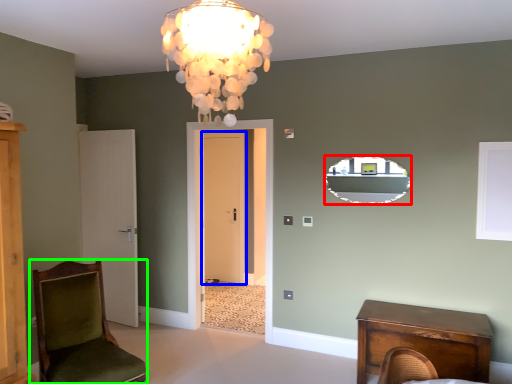
Question: Which is farther away from mirror (highlighted by a red box)? door (highlighted by a blue box) or chair (highlighted by a green box)?

Choices:
 (A) door
 (B) chair

Answer: (A)